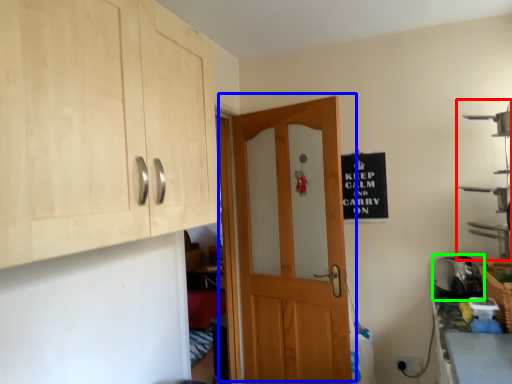
Question: Based on their relative distances, which object is nearer to shelf (highlighted by a red box)? Choose from door (highlighted by a blue box) and appliance (highlighted by a green box).

Choices:
 (A) door
 (B) appliance

Answer: (B)